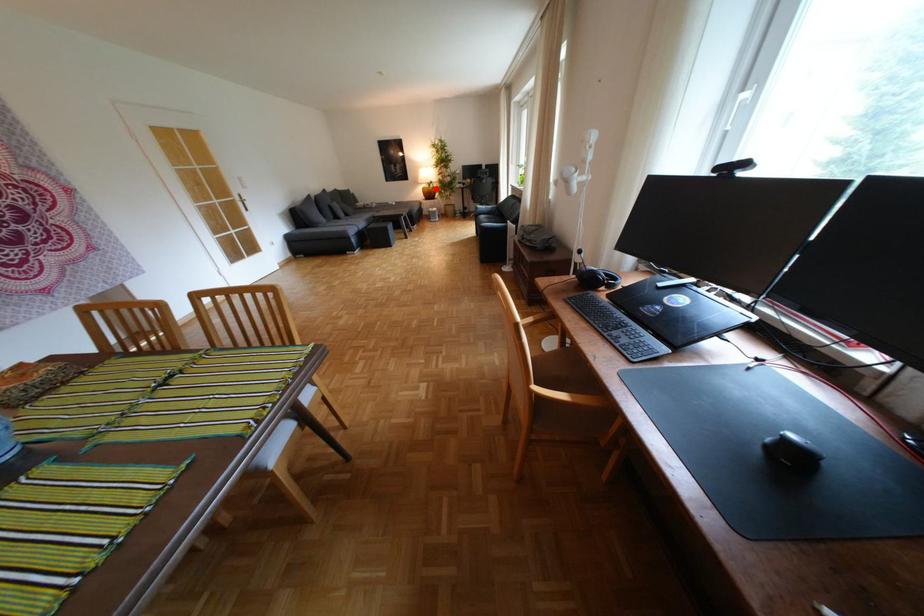
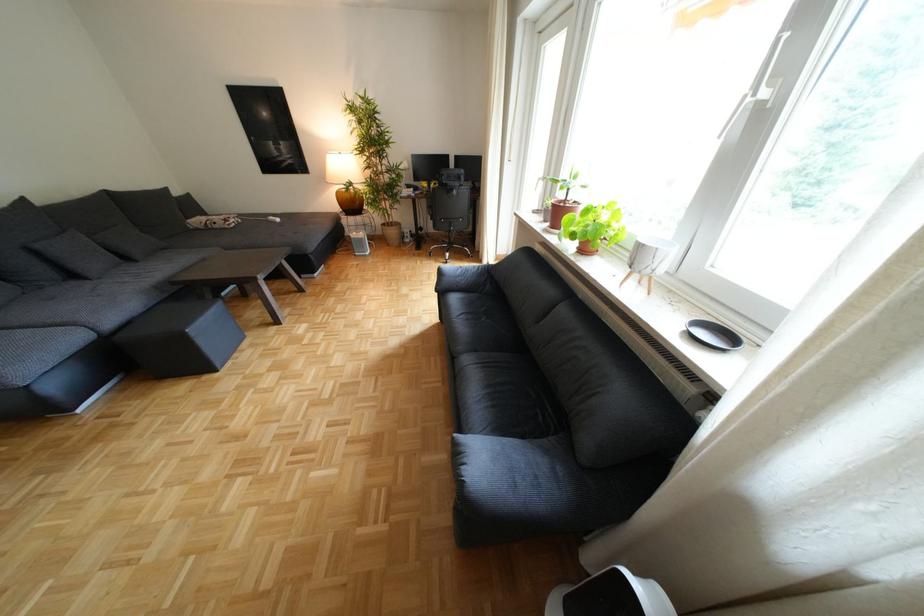
The point at the highlighted location is marked in the first image. Where is the corresponding point in the second image?

(351, 193)